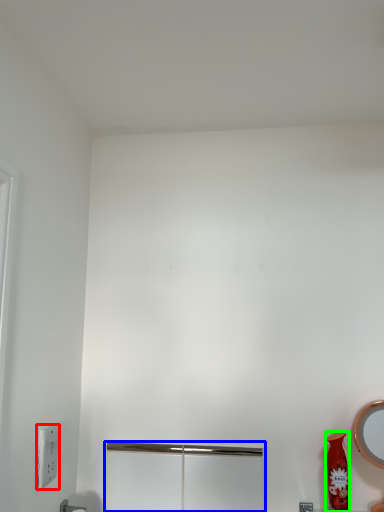
Question: Considering the real-world distances, which object is farthest from light switch (highlighted by a red box)? screen door (highlighted by a blue box) or vase (highlighted by a green box)?

Choices:
 (A) screen door
 (B) vase

Answer: (B)